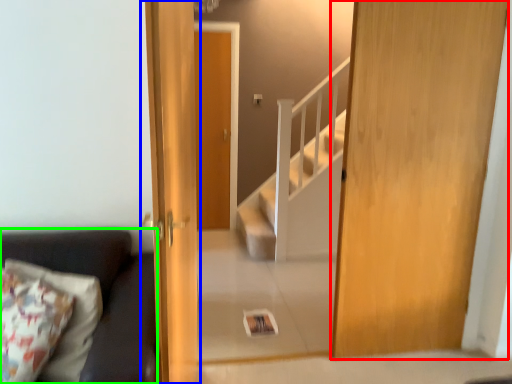
Question: Based on their relative distances, which object is nearer to door (highlighted by a red box)? Choose from door (highlighted by a blue box) and studio couch (highlighted by a green box).

Choices:
 (A) door
 (B) studio couch

Answer: (A)